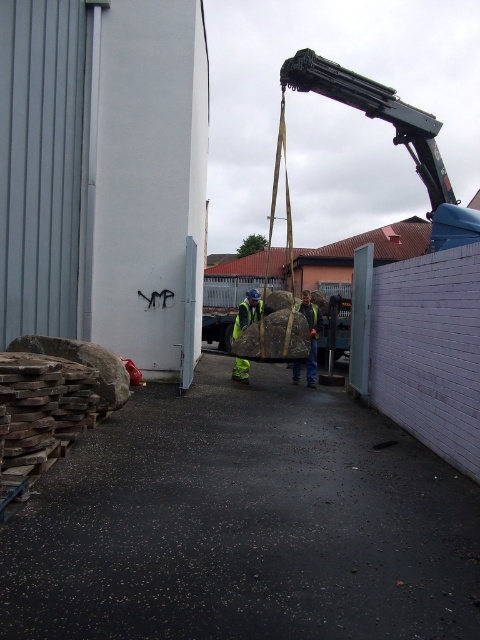
You are a delivery driver who needs to park your truck in the smooth concrete alley at center. However, there is a reflective yellow safety vest at center in the way. Can you safely park your truck there without moving the vest?

The smooth concrete alley at center is below the reflective yellow safety vest at center, meaning the vest is elevated above the alley. Since the vest is likely being worn by a worker standing on the ground or part of equipment overhead, you can park your truck in the alley without moving the vest as it does not block the alley itself.

You are a delivery driver who needs to drive a truck through the smooth concrete alley at center. However, there is a reflective yellow safety vest at center in your path. Can you safely navigate your truck through the alley without hitting the vest?

The smooth concrete alley at center is in front of the reflective yellow safety vest at center, meaning the vest is closer to you than the alley. Since the vest is in your direct path, you cannot safely navigate the truck through the alley without hitting the vest. You should stop and wait until the area is clear.

You are a delivery driver who needs to back your truck into the smooth concrete alley at center. Your truck is 2 meters wide. Can you fit through the alley if the reflective yellow safety vest at center is currently worn by a worker standing in the middle of the alley?

The smooth concrete alley at center is wider than the reflective yellow safety vest at center, so the truck can fit through the alley as long as the worker moves aside.